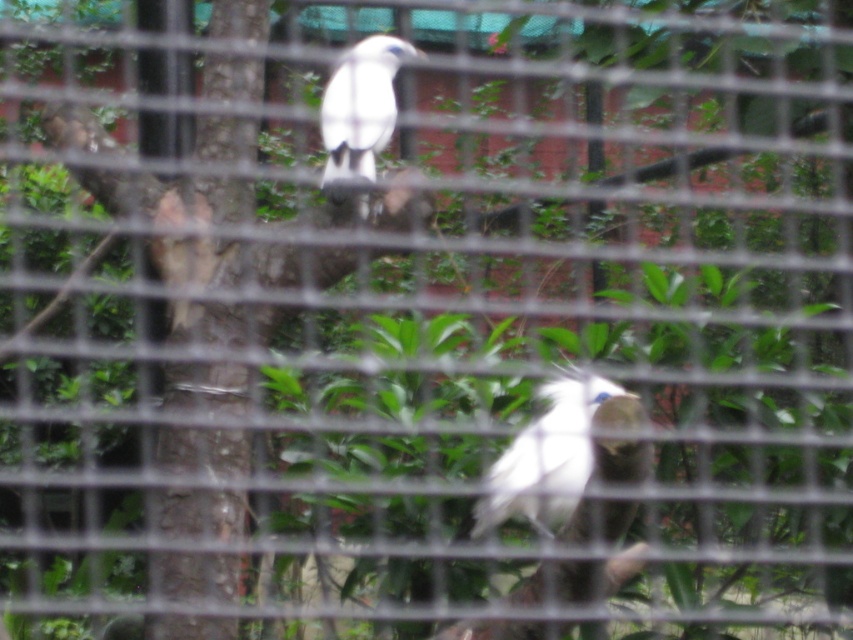
Consider the image. You are a zookeeper trying to feed two birds in their enclosure. The birds are the white feathered bird at center and the white feathered bird at upper center. If you have a 20 inch long feeding stick, can you reach both birds from your current position behind the metal mesh barrier?

The distance between the white feathered bird at center and the white feathered bird at upper center is 20.40 inches. Since the feeding stick is only 20 inches long, it is 0.40 inches shorter than needed. Therefore, you cannot reach both birds with the current feeding stick length.

You are a zookeeper who needs to feed the birds. You have a small container of food that can only reach up to 1 meter. The white feathered bird at center is closer to you than the white feathered bird at upper center. Can you feed both birds with the container from your current position?

The white feathered bird at center is in front of the white feathered bird at upper center, meaning it is closer to you. Since your container can reach up to 1 meter, you can feed the closer bird. However, the distance to the upper bird may exceed the container reach, so you might need to adjust your position or use a longer tool.